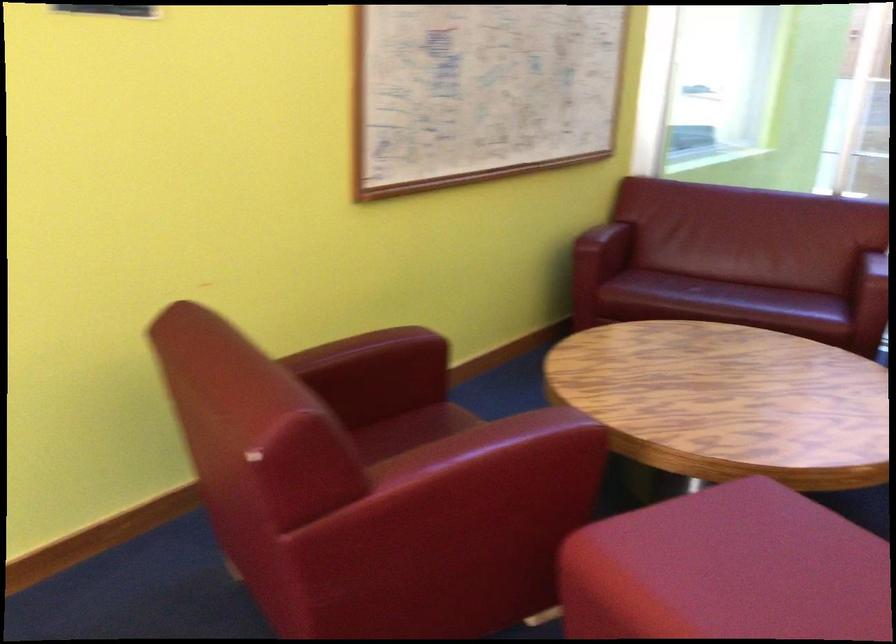
The width and height of the screenshot is (896, 644). What do you see at coordinates (375, 363) in the screenshot?
I see `the chair armrest` at bounding box center [375, 363].